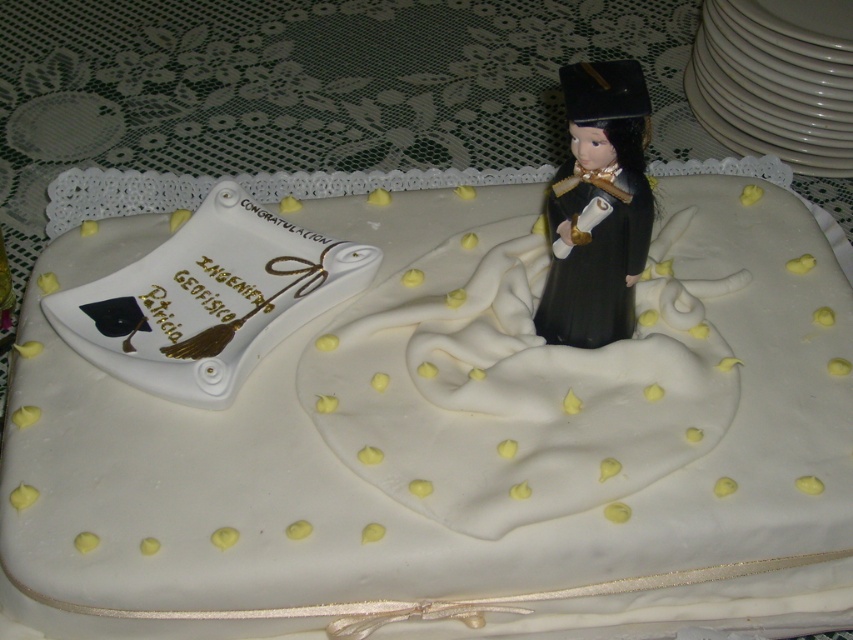
Based on the photo, you are a guest at a graduation party and want to choose between the white fondant cake at center and the white porcelain platter at upper right. Which one is bigger in size?

The white fondant cake at center is larger in size compared to the white porcelain platter at upper right.

You are standing in front of a graduation cake and want to place a small candle exactly 100 centimeters away from the point marked at coordinates point (494, 572). Can you determine if the cake is large enough to accommodate this placement?

The distance between point (494, 572) and the camera is 86.45 centimeters. Since the desired placement requires 100 centimeters, which is farther than the current distance, the cake might not be large enough to accommodate this placement as it would exceed the available space.

You are a photographer standing at a certain distance from the white fondant cake at center. Your camera has a focal length of 50mm and you want to capture the cake in focus with a depth of field of 25 inches. Based on the distance provided, will the entire cake be within the depth of field?

The distance of white fondant cake at center is 32.14 inches. Since the depth of field is 25 inches, which is shorter than the distance to the cake, the entire cake may not be within the depth of field. Adjust the camera settings or move closer to ensure the cake is fully in focus.